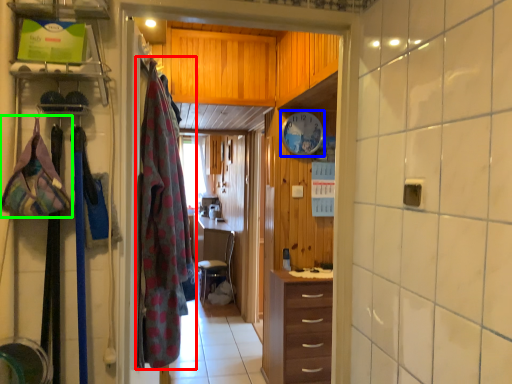
Question: Which object is the farthest from clothing (highlighted by a red box)? Choose among these: clock (highlighted by a blue box) or clothing (highlighted by a green box).

Choices:
 (A) clock
 (B) clothing

Answer: (A)